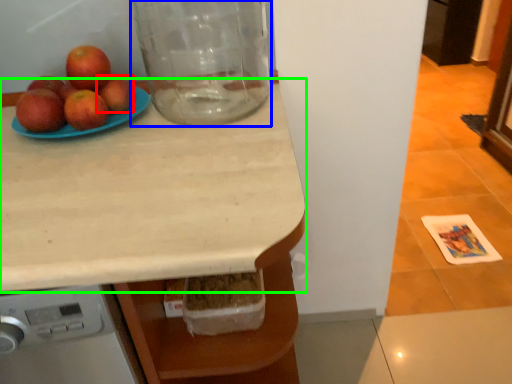
Question: Based on their relative distances, which object is nearer to apple (highlighted by a red box)? Choose from glass jar (highlighted by a blue box) and countertop (highlighted by a green box).

Choices:
 (A) glass jar
 (B) countertop

Answer: (A)